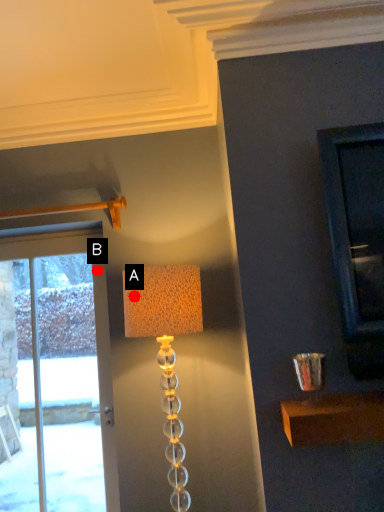
Question: Two points are circled on the image, labeled by A and B beside each circle. Which point appears farthest from the camera in this image?

Choices:
 (A) A is further
 (B) B is further

Answer: (B)